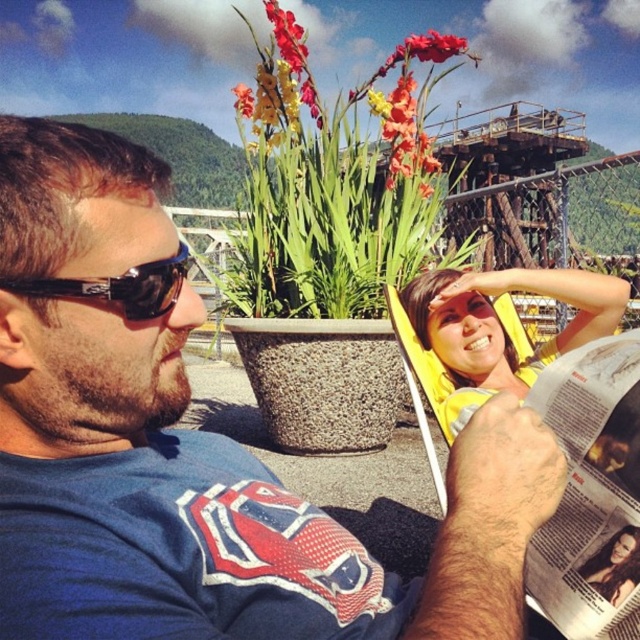
Question: Can you confirm if blue fabric shirt at center is positioned to the right of black plastic sunglasses at left?

Choices:
 (A) yes
 (B) no

Answer: (A)

Question: Which object is farther from the camera taking this photo?

Choices:
 (A) smooth brown hair at center
 (B) blue fabric shirt at center
 (C) black plastic sunglasses at left

Answer: (A)

Question: Where is vivid orange petals at center located in relation to smooth brown hair at center in the image?

Choices:
 (A) below
 (B) above

Answer: (B)

Question: Among these points, which one is farthest from the camera?

Choices:
 (A) (624, 547)
 (B) (538, 275)
 (C) (84, 225)

Answer: (B)

Question: Observing the image, what is the correct spatial positioning of blue fabric shirt at center in reference to vivid orange petals at center?

Choices:
 (A) right
 (B) left

Answer: (B)

Question: Which point is closer to the camera?

Choices:
 (A) smooth brown hair at center
 (B) black plastic sunglasses at left
 (C) yellow fabric at upper center
 (D) blue fabric shirt at center

Answer: (D)